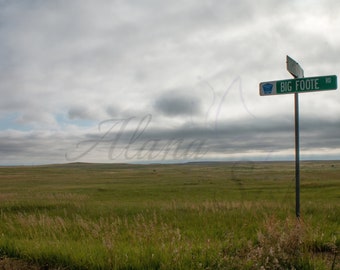
Find the location of a particular element. The width and height of the screenshot is (340, 270). tall plants is located at coordinates pos(32,224), pos(51,224), pos(69,224), pos(96,228), pos(124,231), pos(153,235), pos(165,235), pos(264,240), pos(292,223).